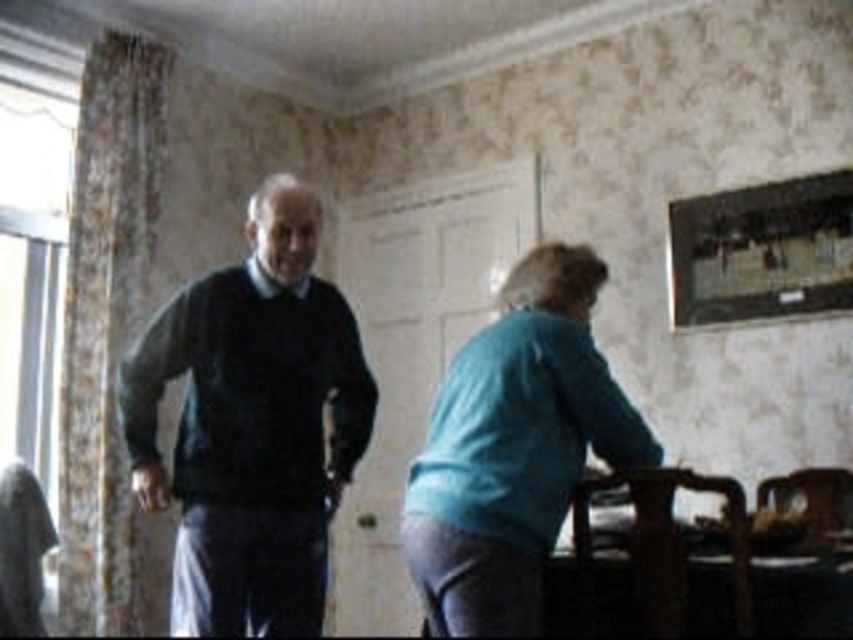
Does dark blue sweater at center have a lesser height compared to teal fabric skirt at lower right?

No.

Does dark blue sweater at center appear over teal fabric skirt at lower right?

No.

Does point (492, 467) come in front of point (514, 298)?

Yes, point (492, 467) is in front of point (514, 298).

Where is `dark blue sweater at center`? dark blue sweater at center is located at coordinates (514, 448).

Identify the location of dark blue sweater at center. The height and width of the screenshot is (640, 853). (514, 448).

Does dark blue sweater at center have a lesser width compared to dark gray sweater at center?

Correct, dark blue sweater at center's width is less than dark gray sweater at center's.

Which is in front, point (564, 278) or point (141, 394)?

Point (564, 278)

The image size is (853, 640). In order to click on dark blue sweater at center in this screenshot , I will do `click(514, 448)`.

From the picture: Is dark gray sweater at center bigger than teal fabric skirt at lower right?

Indeed, dark gray sweater at center has a larger size compared to teal fabric skirt at lower right.

Identify the location of dark gray sweater at center. (252, 426).